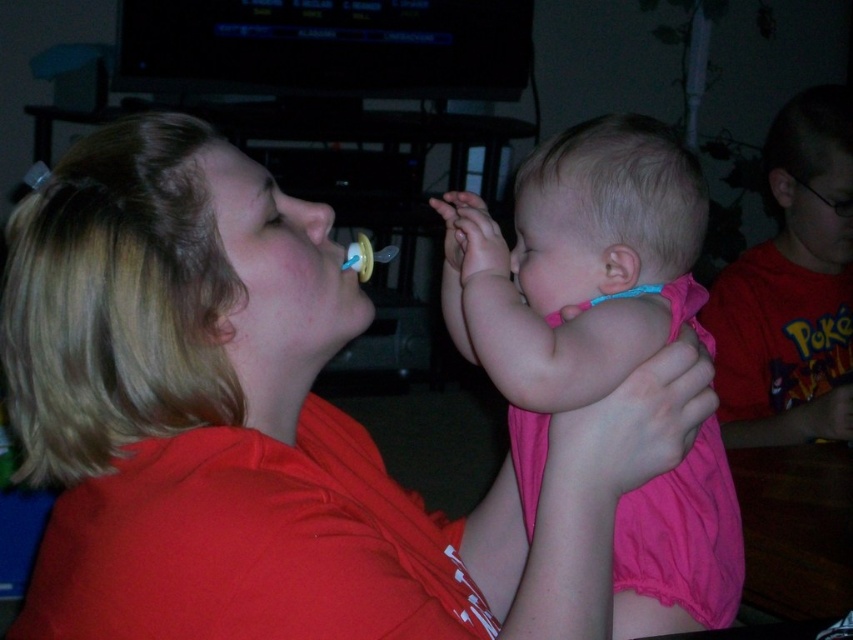
What do you see at coordinates (792, 289) in the screenshot?
I see `pink fabric shirt at right` at bounding box center [792, 289].

Does pink fabric shirt at right have a lesser width compared to yellow rubber baby bottle at center?

No.

Between point (714, 320) and point (390, 252), which one is positioned behind?

Positioned behind is point (714, 320).

You are a GUI agent. You are given a task and a screenshot of the screen. Output one action in this format:
    pyautogui.click(x=<x>, y=<y>)
    Task: Click on the pink fabric shirt at right
    This screenshot has height=640, width=853.
    Given the screenshot: What is the action you would take?
    pyautogui.click(x=792, y=289)

Is pink fabric at center thinner than pink fabric shirt at right?

Indeed, pink fabric at center has a lesser width compared to pink fabric shirt at right.

The width and height of the screenshot is (853, 640). What do you see at coordinates (575, 275) in the screenshot?
I see `pink fabric at center` at bounding box center [575, 275].

Image resolution: width=853 pixels, height=640 pixels. I want to click on pink fabric at center, so click(575, 275).

The image size is (853, 640). I want to click on pink fabric at center, so click(575, 275).

Between matte red shirt at center and pink fabric at center, which one is positioned lower?

matte red shirt at center

Is point (102, 449) more distant than point (664, 163)?

No, it is in front of (664, 163).

Does point (115, 406) come farther from viewer compared to point (457, 248)?

No, (115, 406) is in front of (457, 248).

Identify the location of matte red shirt at center. (268, 426).